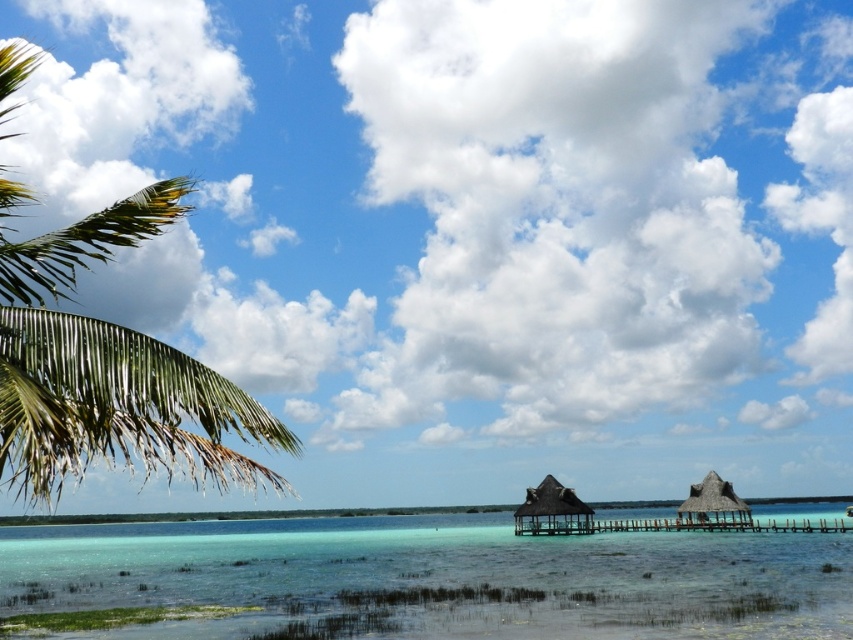
Question: Which of the following is the farthest from the observer?

Choices:
 (A) green leafy palm tree at left
 (B) clear water at lower center

Answer: (B)

Question: Is clear water at lower center positioned at the back of green leafy palm tree at left?

Choices:
 (A) no
 (B) yes

Answer: (B)

Question: Does clear water at lower center appear on the right side of green leafy palm tree at left?

Choices:
 (A) yes
 (B) no

Answer: (A)

Question: Which point is closer to the camera taking this photo?

Choices:
 (A) (84, 419)
 (B) (555, 557)

Answer: (A)

Question: Can you confirm if clear water at lower center is positioned to the left of green leafy palm tree at left?

Choices:
 (A) yes
 (B) no

Answer: (B)